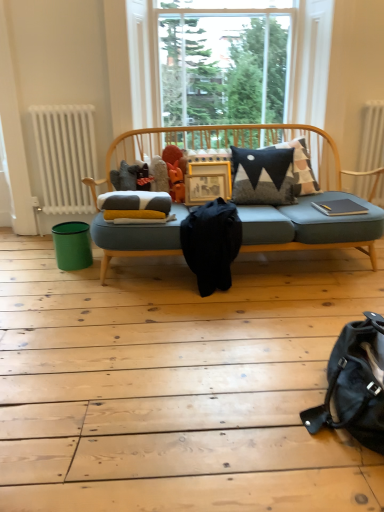
Question: Should I look upward or downward to see wooden frame at center?

Choices:
 (A) up
 (B) down

Answer: (A)

Question: Which direction should I rotate to look at black fabric messenger bag at center, which appears as the 1th messenger bag when viewed from the left, — up or down?

Choices:
 (A) up
 (B) down

Answer: (A)

Question: Is teal plastic bin at lower left bigger than white radiator at left, the first radiator in the left-to-right sequence?

Choices:
 (A) no
 (B) yes

Answer: (A)

Question: Is teal plastic bin at lower left not near white radiator at left, the first radiator in the left-to-right sequence?

Choices:
 (A) no
 (B) yes

Answer: (A)

Question: Can you confirm if teal plastic bin at lower left is taller than white radiator at left, marked as the 2th radiator in a right-to-left arrangement?

Choices:
 (A) yes
 (B) no

Answer: (B)

Question: Does teal plastic bin at lower left have a lesser width compared to white radiator at left, marked as the 2th radiator in a right-to-left arrangement?

Choices:
 (A) no
 (B) yes

Answer: (A)

Question: Is teal plastic bin at lower left smaller than white radiator at left, the first radiator in the left-to-right sequence?

Choices:
 (A) yes
 (B) no

Answer: (A)

Question: From a real-world perspective, is teal plastic bin at lower left below white radiator at left, marked as the 2th radiator in a right-to-left arrangement?

Choices:
 (A) yes
 (B) no

Answer: (A)

Question: Can you confirm if teal plastic bin at lower left is taller than clear glass window at center?

Choices:
 (A) no
 (B) yes

Answer: (A)

Question: Could you tell me if teal plastic bin at lower left is turned towards clear glass window at center?

Choices:
 (A) yes
 (B) no

Answer: (B)

Question: Is clear glass window at center completely or partially inside teal plastic bin at lower left?

Choices:
 (A) yes
 (B) no

Answer: (B)

Question: Can you confirm if teal plastic bin at lower left is positioned to the right of clear glass window at center?

Choices:
 (A) yes
 (B) no

Answer: (B)

Question: From the image's perspective, is teal plastic bin at lower left located above clear glass window at center?

Choices:
 (A) no
 (B) yes

Answer: (A)

Question: Is teal plastic bin at lower left further to camera compared to clear glass window at center?

Choices:
 (A) yes
 (B) no

Answer: (B)

Question: Is teal plastic bin at lower left oriented away from orange matte figurine at center?

Choices:
 (A) yes
 (B) no

Answer: (B)